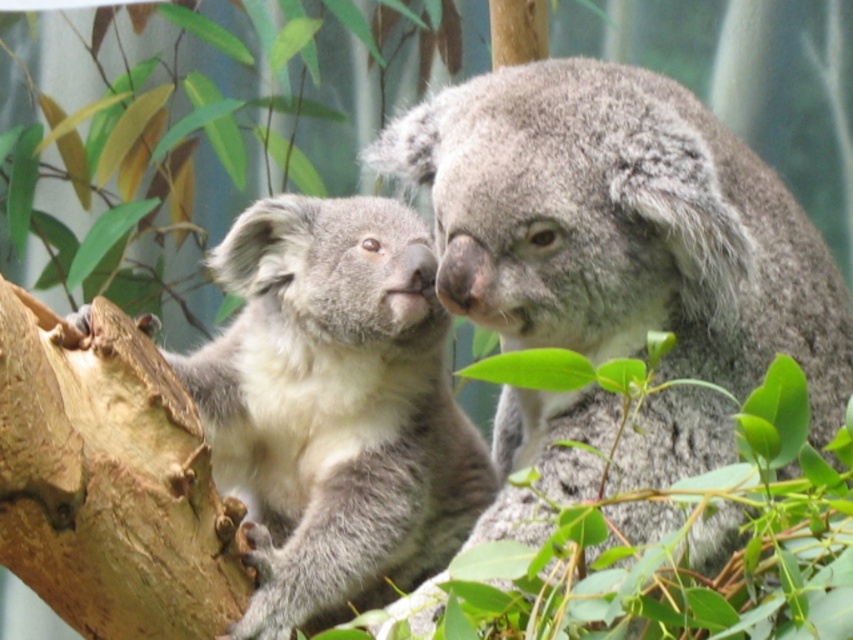
Based on the photo, you are a photographer trying to capture the two points in the image. The first point is at coordinates point (699, 547) and the second point is at point (395, 323). Which point should you focus on to ensure both points are in sharp focus?

To ensure both points are in sharp focus, you should focus on point (395, 323) because it is farther away from the camera than point (699, 547). Focusing on the farther point will allow the closer point to be within the depth of field.

You are a wildlife photographer aiming to capture both the gray fluffy koala at center and the gray furry koala at left in a single frame. Given their sizes, which koala will appear larger in the photo?

The gray fluffy koala at center will appear larger in the photo because its width surpasses that of the gray furry koala at left.